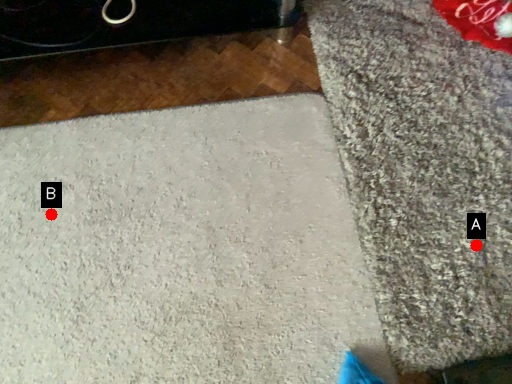
Question: Two points are circled on the image, labeled by A and B beside each circle. Which of the following is the farthest from the observer?

Choices:
 (A) A is further
 (B) B is further

Answer: (B)